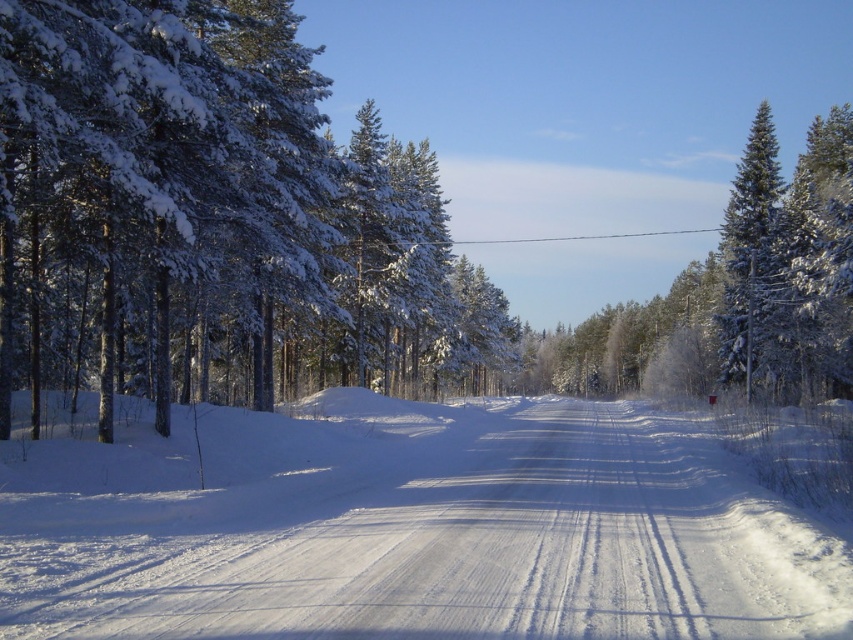
Does point (186, 157) come in front of point (770, 308)?

Yes.

Can you confirm if snow-covered pine trees at left is positioned above green snow-covered tree at right?

No, snow-covered pine trees at left is not above green snow-covered tree at right.

Find the location of a particular element. The width and height of the screenshot is (853, 640). snow-covered pine trees at left is located at coordinates (213, 220).

Identify the location of snow-covered pine trees at left. The height and width of the screenshot is (640, 853). (213, 220).

Which is in front, point (287, 627) or point (496, 355)?

Point (287, 627) is in front.

Can you confirm if white snow-covered dirt track at center is positioned below snow-covered pine trees at left?

Yes, white snow-covered dirt track at center is below snow-covered pine trees at left.

Is point (263, 525) positioned in front of point (462, 298)?

Yes, it is.

This screenshot has height=640, width=853. Find the location of `white snow-covered dirt track at center`. white snow-covered dirt track at center is located at coordinates (409, 529).

Does point (186, 531) come farther from viewer compared to point (722, 321)?

No, it is not.

Is point (647, 556) less distant than point (746, 364)?

Yes, point (647, 556) is closer to viewer.

Locate an element on the screen. Image resolution: width=853 pixels, height=640 pixels. white snow-covered dirt track at center is located at coordinates [x=409, y=529].